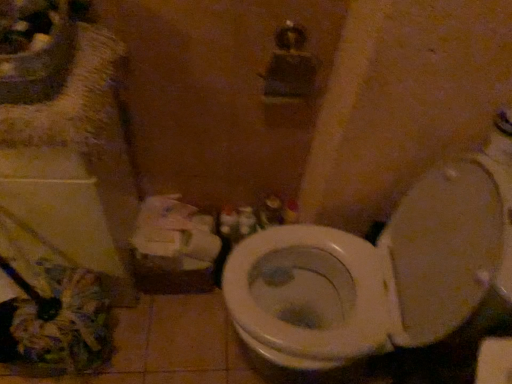
What is the approximate height of white plastic container at center?

white plastic container at center is 8.26 inches tall.

In order to click on white plastic container at center in this screenshot , I will do `click(246, 221)`.

Measure the distance between point (21, 89) and camera.

A distance of 28.39 inches exists between point (21, 89) and camera.

You are a GUI agent. You are given a task and a screenshot of the screen. Output one action in this format:
    pyautogui.click(x=<x>, y=<y>)
    Task: Click on the white glossy toilet at center
    This screenshot has width=512, height=384.
    Given the screenshot: What is the action you would take?
    pyautogui.click(x=376, y=273)

Which object is closer to the camera, white plastic container at center or matte white sink at upper left?

matte white sink at upper left is more forward.

Between white plastic container at center and matte white sink at upper left, which one has larger width?

With larger width is matte white sink at upper left.

Is there a large distance between white plastic container at center and matte white sink at upper left?

white plastic container at center is near matte white sink at upper left, not far away.

Does white matte toilet paper at lower left lie behind matte white sink at upper left?

Yes, white matte toilet paper at lower left is further from the camera.

Is white matte toilet paper at lower left smaller than matte white sink at upper left?

No, white matte toilet paper at lower left is not smaller than matte white sink at upper left.

Is white matte toilet paper at lower left next to matte white sink at upper left and touching it?

No, white matte toilet paper at lower left is not next to matte white sink at upper left.

Is white matte toilet paper at lower left not within matte white sink at upper left?

Yes.

Is white matte toilet paper at lower left inside matte white sink at upper left?

Actually, white matte toilet paper at lower left is outside matte white sink at upper left.

Is matte white sink at upper left not near white matte toilet paper at lower left?

No, matte white sink at upper left is in close proximity to white matte toilet paper at lower left.

Between matte white sink at upper left and white matte toilet paper at lower left, which one appears on the right side from the viewer's perspective?

white matte toilet paper at lower left is more to the right.

Does point (54, 15) appear closer or farther from the camera than point (174, 220)?

Point (54, 15) is positioned closer to the camera compared to point (174, 220).

This screenshot has width=512, height=384. What are the coordinates of `toiletry below the white matte toilet paper at lower left (from a real-world perspective)` in the screenshot? It's located at (246, 221).

From a real-world perspective, between white plastic container at center and white matte toilet paper at lower left, who is vertically higher?

white matte toilet paper at lower left is physically above.

Would you say white plastic container at center is a long distance from white matte toilet paper at lower left?

white plastic container at center is near white matte toilet paper at lower left, not far away.

Consider the image. From the image's perspective, between white plastic container at center and white matte toilet paper at lower left, who is located below?

From the image's view, white matte toilet paper at lower left is below.

Is white matte toilet paper at lower left taller or shorter than white glossy toilet at center?

Considering their sizes, white matte toilet paper at lower left has less height than white glossy toilet at center.

Considering the sizes of objects white matte toilet paper at lower left and white glossy toilet at center in the image provided, who is thinner, white matte toilet paper at lower left or white glossy toilet at center?

With smaller width is white matte toilet paper at lower left.

From the image's perspective, would you say white matte toilet paper at lower left is shown under white glossy toilet at center?

No, from the image's perspective, white matte toilet paper at lower left is not below white glossy toilet at center.

From the picture: From a real-world perspective, is white matte toilet paper at lower left physically above white glossy toilet at center?

Actually, white matte toilet paper at lower left is physically below white glossy toilet at center in the real world.

Could you tell me if matte white sink at upper left is turned towards white plastic container at center?

No, matte white sink at upper left is not facing towards white plastic container at center.

What are the coordinates of `toiletry that appears on the right of matte white sink at upper left` in the screenshot? It's located at (246, 221).

Between point (42, 35) and point (245, 214), which one is positioned in front?

The point (42, 35) is in front.

Is matte white sink at upper left outside of white plastic container at center?

Yes, matte white sink at upper left is outside of white plastic container at center.

Between white glossy toilet at center and white plastic container at center, which one appears on the right side from the viewer's perspective?

white glossy toilet at center.

Can you confirm if white glossy toilet at center is wider than white plastic container at center?

Indeed, white glossy toilet at center has a greater width compared to white plastic container at center.

From their relative heights in the image, would you say white glossy toilet at center is taller or shorter than white plastic container at center?

In the image, white glossy toilet at center appears to be taller than white plastic container at center.

Is there a large distance between white glossy toilet at center and white plastic container at center?

They are positioned close to each other.

This screenshot has height=384, width=512. Identify the location of sink located above the white plastic container at center (from the image's perspective). (34, 49).

In order to click on sink located above the white matte toilet paper at lower left (from a real-world perspective) in this screenshot , I will do `click(34, 49)`.

Estimate the real-world distances between objects in this image. Which object is closer to matte white sink at upper left, white matte toilet paper at lower left or white plastic container at center?

Based on the image, white matte toilet paper at lower left appears to be nearer to matte white sink at upper left.

Based on their spatial positions, is matte white sink at upper left or white glossy toilet at center further from white matte toilet paper at lower left?

matte white sink at upper left.

From the image, which object appears to be nearer to white matte toilet paper at lower left, white glossy toilet at center or white plastic container at center?

white plastic container at center is positioned closer to the anchor white matte toilet paper at lower left.

Estimate the real-world distances between objects in this image. Which object is further from white glossy toilet at center, white plastic container at center or white matte toilet paper at lower left?

Based on the image, white plastic container at center appears to be further to white glossy toilet at center.

When comparing their distances from matte white sink at upper left, does white plastic container at center or white matte toilet paper at lower left seem closer?

The object closer to matte white sink at upper left is white matte toilet paper at lower left.

Looking at the image, which one is located closer to white plastic container at center, white glossy toilet at center or white matte toilet paper at lower left?

white matte toilet paper at lower left is positioned closer to the anchor white plastic container at center.

Estimate the real-world distances between objects in this image. Which object is further from matte white sink at upper left, white glossy toilet at center or white plastic container at center?

white plastic container at center is further to matte white sink at upper left.

Estimate the real-world distances between objects in this image. Which object is further from white glossy toilet at center, white matte toilet paper at lower left or matte white sink at upper left?

matte white sink at upper left is further to white glossy toilet at center.

This screenshot has height=384, width=512. What are the coordinates of `toilet paper situated between matte white sink at upper left and white glossy toilet at center from left to right` in the screenshot? It's located at (173, 231).

Find the location of a particular element. sink between white glossy toilet at center and white plastic container at center from front to back is located at coordinates (34, 49).

Identify the location of toilet paper located between white glossy toilet at center and white plastic container at center in the depth direction. This screenshot has height=384, width=512. (173, 231).

Locate an element on the screen. The image size is (512, 384). toilet paper between matte white sink at upper left and white plastic container at center in the front-back direction is located at coordinates (173, 231).